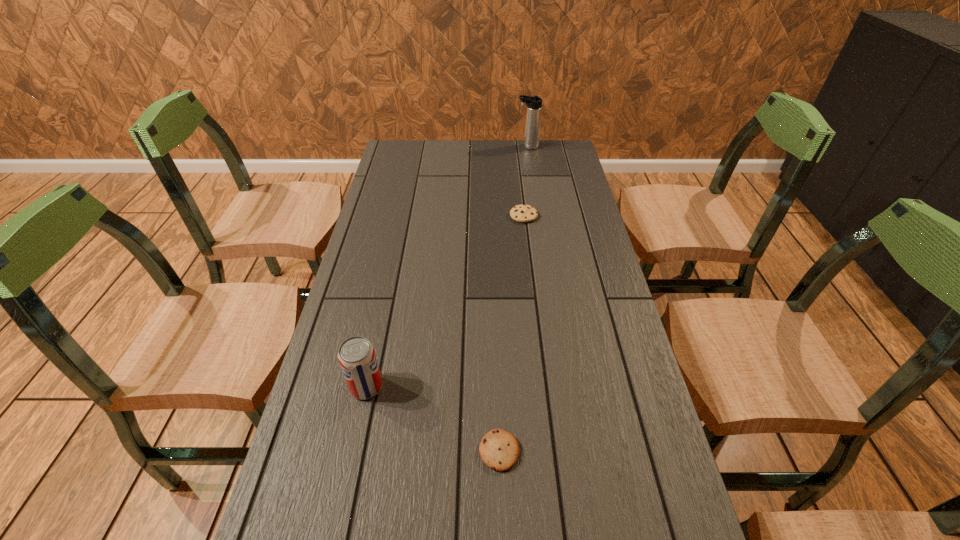
Where is `vacant space at the right edge`? The height and width of the screenshot is (540, 960). vacant space at the right edge is located at coordinates (570, 189).

This screenshot has width=960, height=540. What are the coordinates of `vacant area that lies between the thermos bottle and the nearest object` in the screenshot? It's located at (514, 299).

The width and height of the screenshot is (960, 540). I want to click on vacant space that's between the leftmost object and the thermos bottle, so click(447, 267).

The height and width of the screenshot is (540, 960). I want to click on free area in between the thermos bottle and the shorter cookie, so click(514, 299).

Identify the location of free point between the farther cookie and the tallest object. The width and height of the screenshot is (960, 540). (525, 181).

Find the location of `free point between the farther cookie and the farthest object`. free point between the farther cookie and the farthest object is located at coordinates (525, 181).

Where is `empty location between the second nearest object and the farthest object`? This screenshot has width=960, height=540. empty location between the second nearest object and the farthest object is located at coordinates (447, 267).

The height and width of the screenshot is (540, 960). I want to click on blank region between the second nearest object and the nearer cookie, so click(433, 419).

The height and width of the screenshot is (540, 960). What are the coordinates of `vacant space that is in between the tallest object and the shortest object` in the screenshot? It's located at (514, 299).

Find the location of a particular element. Image resolution: width=960 pixels, height=540 pixels. empty space between the second tallest object and the taller cookie is located at coordinates (445, 301).